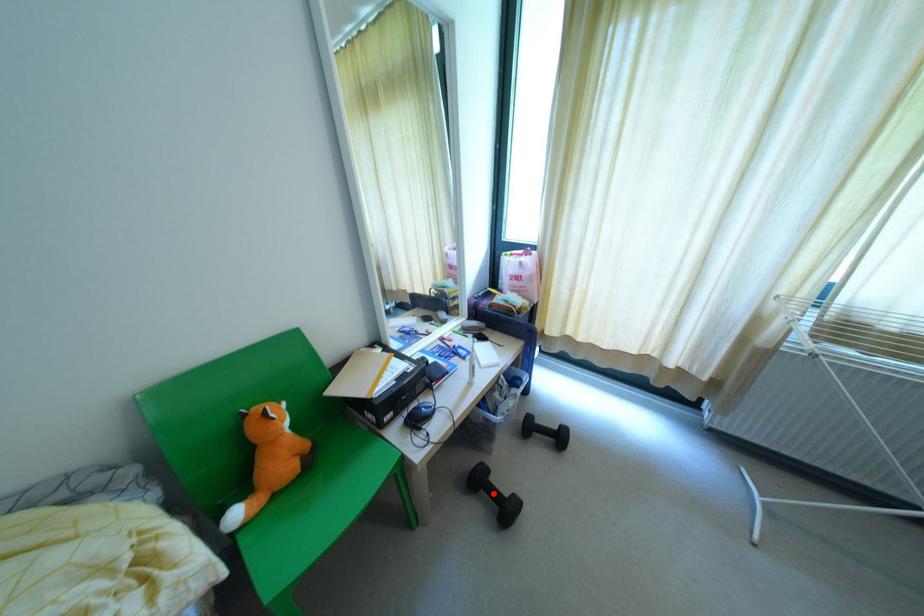
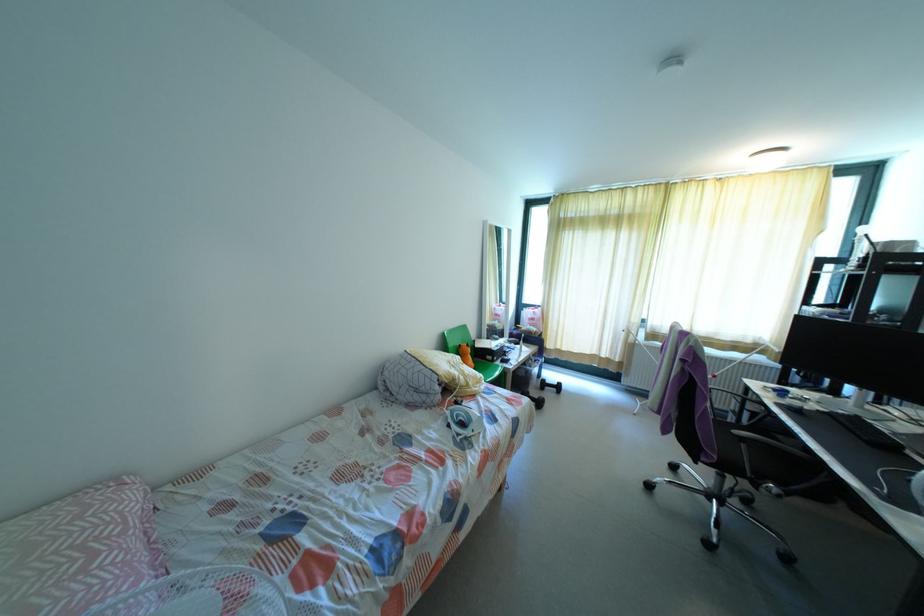
Question: I am providing you with two images of the same scene from different viewpoints. Given a red point in image1, look at the same physical point in image2. Is it:

Choices:
 (A) Closer to the viewpoint
 (B) Farther from the viewpoint

Answer: (B)